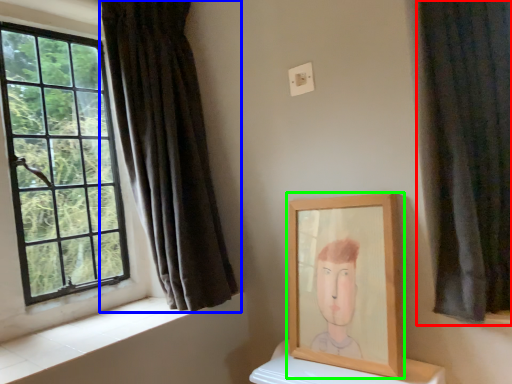
Question: Which is farther away from curtain (highlighted by a red box)? curtain (highlighted by a blue box) or picture frame (highlighted by a green box)?

Choices:
 (A) curtain
 (B) picture frame

Answer: (A)